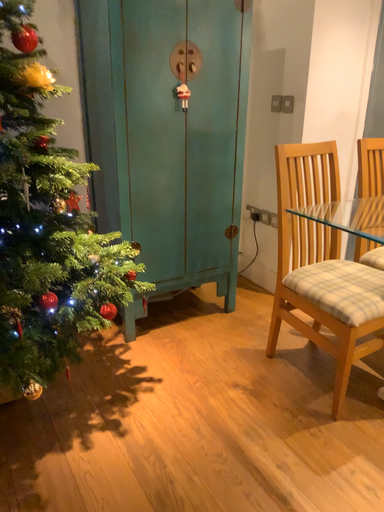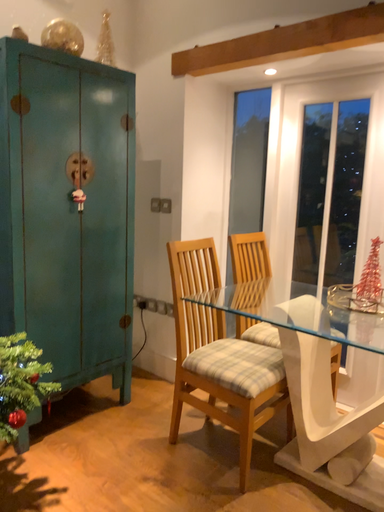
Question: Which way did the camera rotate in the video?

Choices:
 (A) rotated upward
 (B) rotated downward

Answer: (A)